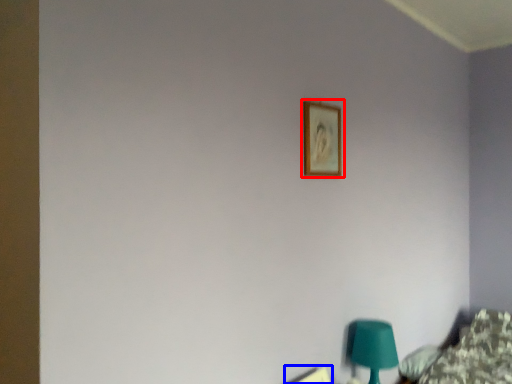
Question: Which object is further to the camera taking this photo, picture frame (highlighted by a red box) or picture frame (highlighted by a blue box)?

Choices:
 (A) picture frame
 (B) picture frame

Answer: (A)